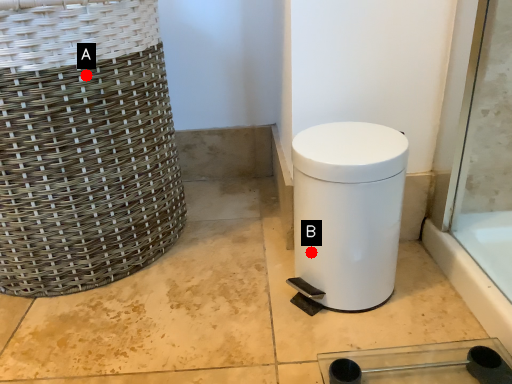
Question: Two points are circled on the image, labeled by A and B beside each circle. Which point is farther from the camera taking this photo?

Choices:
 (A) A is further
 (B) B is further

Answer: (B)